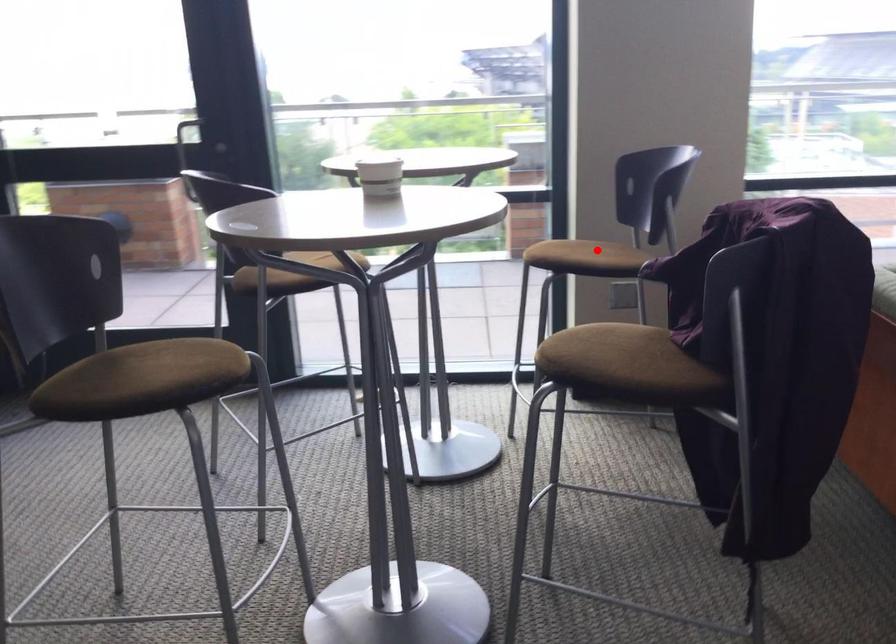
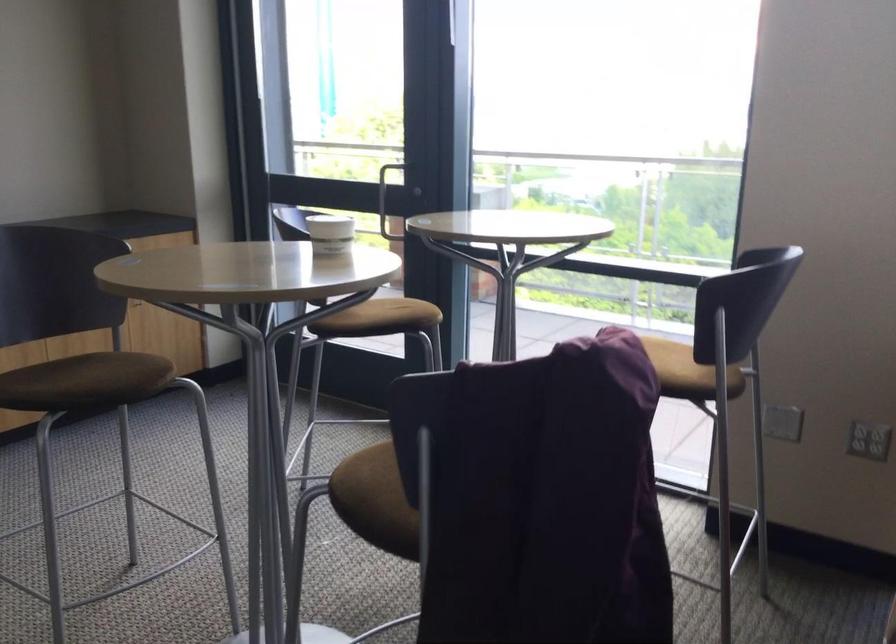
Find the pixel in the second image that matches the highlighted location in the first image.

(669, 359)